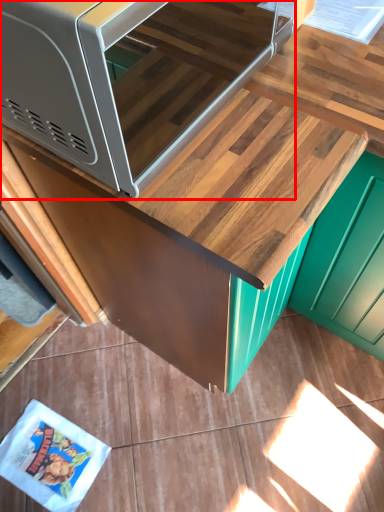
Question: From the image's perspective, considering the relative positions of microwave (annotated by the red box) and cabinetry in the image provided, where is microwave (annotated by the red box) located with respect to the staircase?

Choices:
 (A) below
 (B) above

Answer: (B)